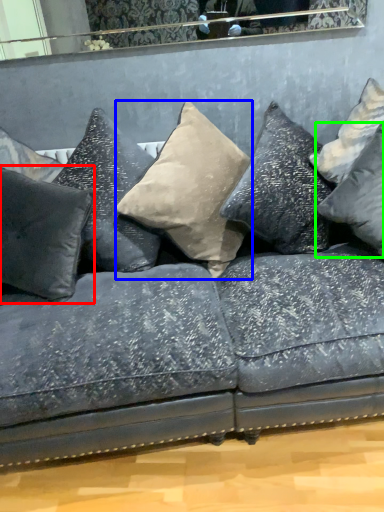
Question: Which is nearer to the pillow (highlighted by a red box)? pillow (highlighted by a blue box) or pillow (highlighted by a green box).

Choices:
 (A) pillow
 (B) pillow

Answer: (A)